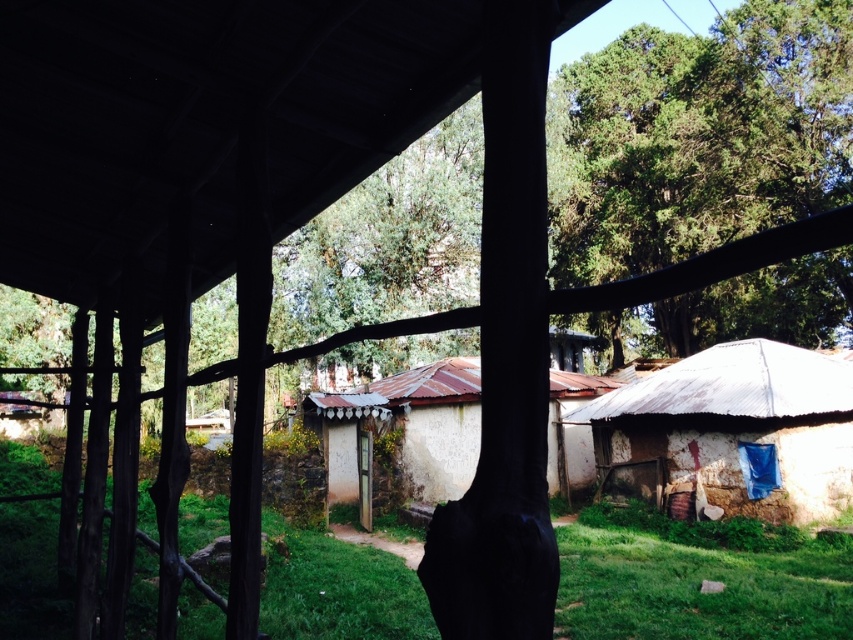
How much distance is there between green leafy tree at upper center and green grass at lower center?

They are 22.24 meters apart.

Between point (766, 156) and point (608, 579), which one is positioned behind?

Point (766, 156)

Between point (817, 205) and point (317, 605), which one is positioned in front?

Point (317, 605) is more forward.

Find the location of a particular element. The height and width of the screenshot is (640, 853). green leafy tree at upper center is located at coordinates (705, 136).

Is point (752, 396) behind point (416, 412)?

No, it is in front of (416, 412).

Where is `white corrugated metal hut at lower right`? This screenshot has width=853, height=640. white corrugated metal hut at lower right is located at coordinates coord(735,429).

Does green grass at lower center appear over white matte hut at center?

No, green grass at lower center is not above white matte hut at center.

Is green grass at lower center to the left of white matte hut at center from the viewer's perspective?

Indeed, green grass at lower center is positioned on the left side of white matte hut at center.

Measure the distance between point (323, 561) and camera.

Point (323, 561) and camera are 9.89 meters apart from each other.

This screenshot has height=640, width=853. In order to click on green grass at lower center in this screenshot , I will do `click(697, 588)`.